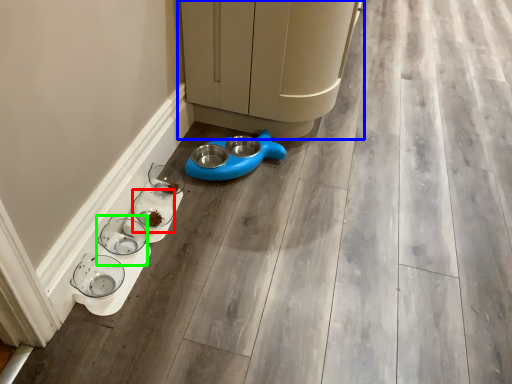
Question: Which object is positioned farthest from glass bowl (highlighted by a red box)? Select from furniture (highlighted by a blue box) and glass bowl (highlighted by a green box).

Choices:
 (A) furniture
 (B) glass bowl

Answer: (A)